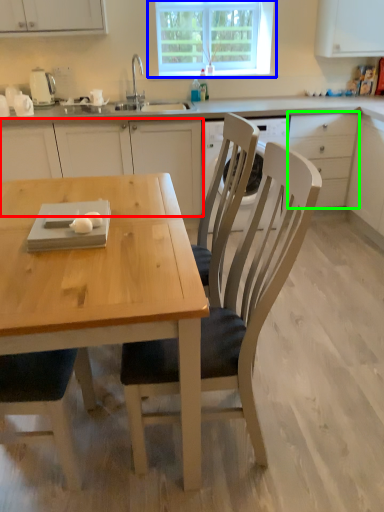
Question: Which object is positioned farthest from cabinetry (highlighted by a red box)? Select from window (highlighted by a blue box) and drawer (highlighted by a green box).

Choices:
 (A) window
 (B) drawer

Answer: (B)